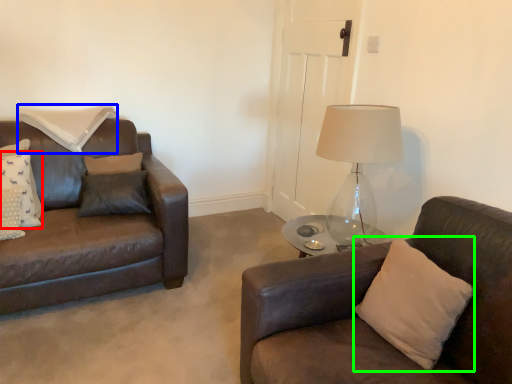
Question: Estimate the real-world distances between objects in this image. Which object is farther from pillow (highlighted by a red box), pillow (highlighted by a blue box) or pillow (highlighted by a green box)?

Choices:
 (A) pillow
 (B) pillow

Answer: (B)